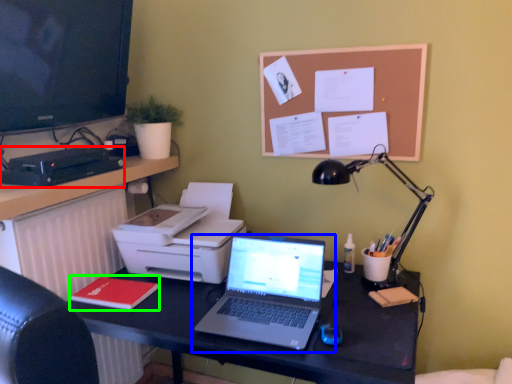
Question: Which is nearer to the stationery (highlighted by a red box)? laptop (highlighted by a blue box) or notepad (highlighted by a green box).

Choices:
 (A) laptop
 (B) notepad

Answer: (B)